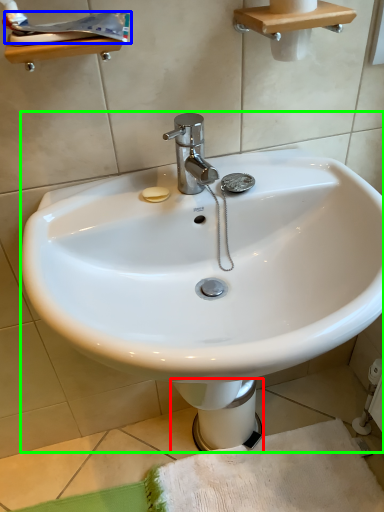
Question: Considering the real-world distances, which object is farthest from bidet (highlighted by a red box)? toothpaste (highlighted by a blue box) or sink (highlighted by a green box)?

Choices:
 (A) toothpaste
 (B) sink

Answer: (A)